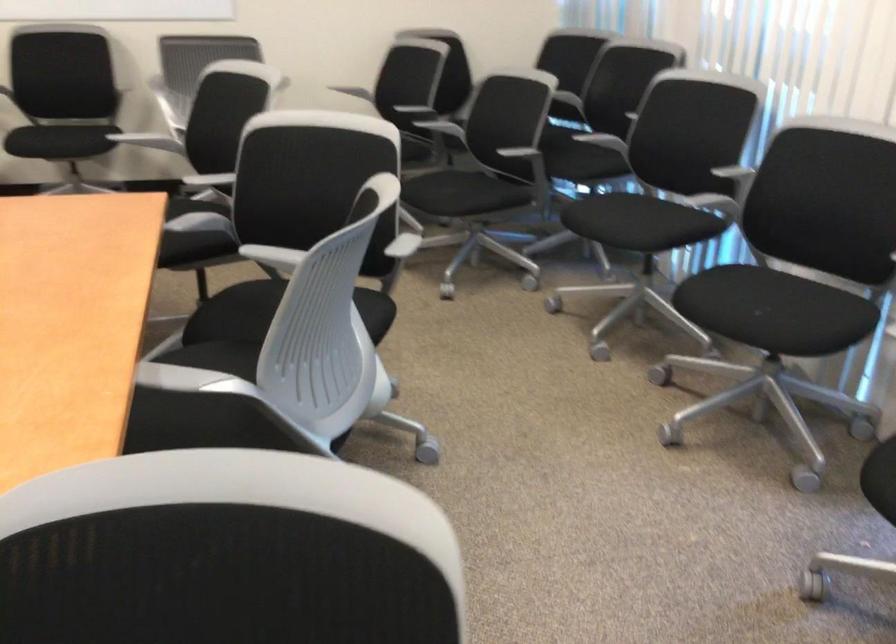
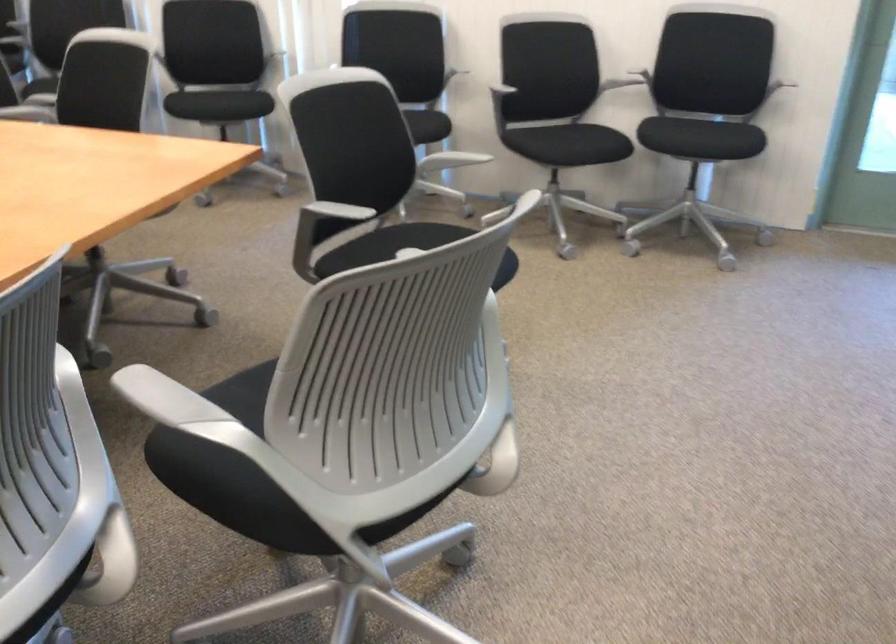
Find the pixel in the second image that matches (x=780, y=328) in the first image.

(238, 102)